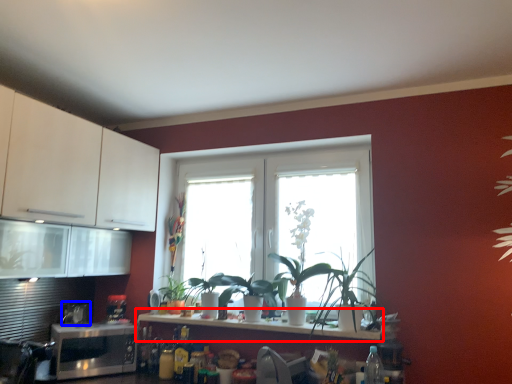
Question: Which object is further to the camera taking this photo, countertop (highlighted by a red box) or appliance (highlighted by a blue box)?

Choices:
 (A) countertop
 (B) appliance

Answer: (B)